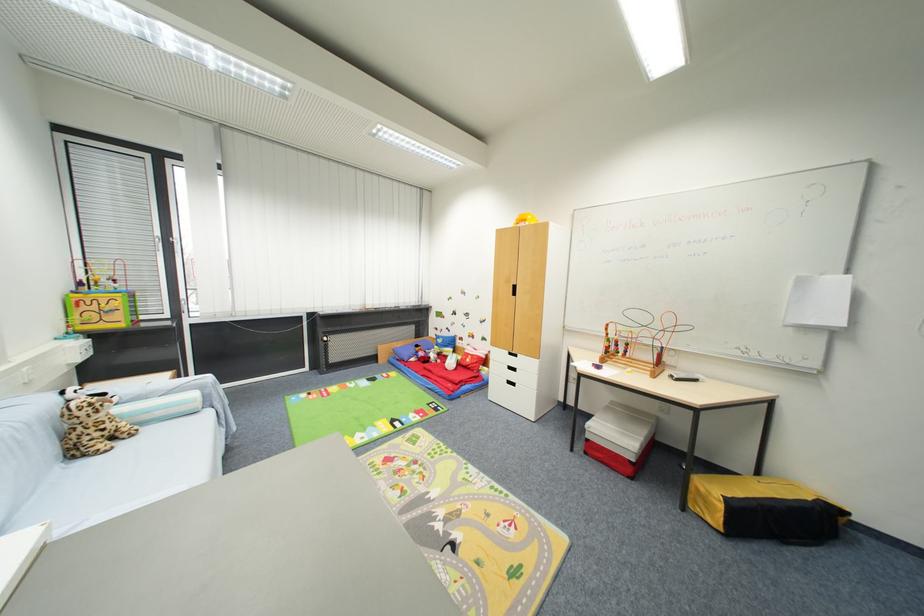
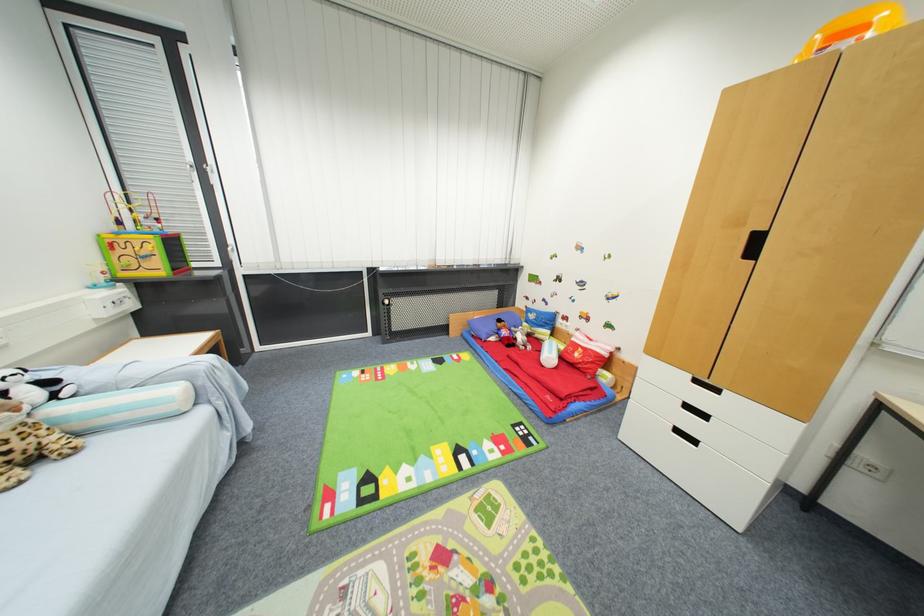
Find the pixel in the second image that matches point 530,222 in the first image.

(868, 30)